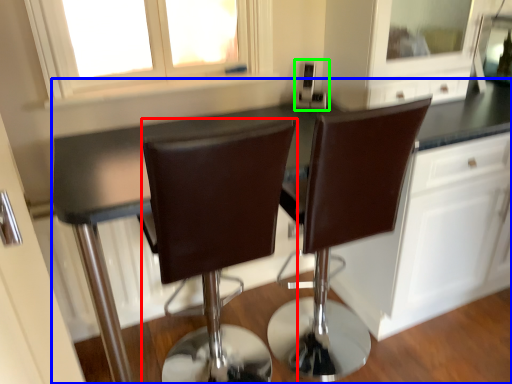
Question: Which object is positioned farthest from chair (highlighted by a red box)? Select from countertop (highlighted by a blue box) and appliance (highlighted by a green box).

Choices:
 (A) countertop
 (B) appliance

Answer: (B)